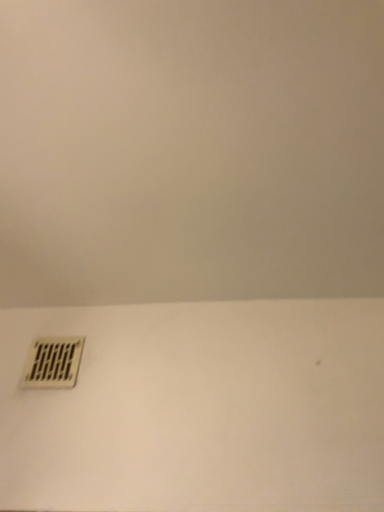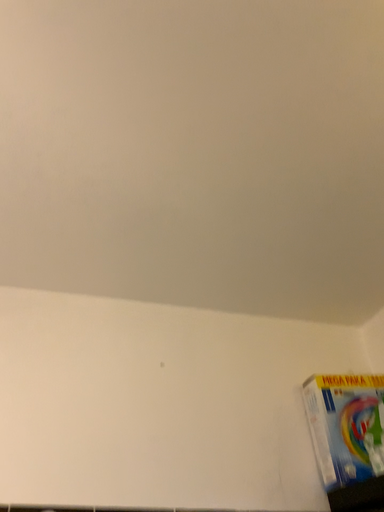
Question: Which way did the camera rotate in the video?

Choices:
 (A) rotated right
 (B) rotated left

Answer: (A)